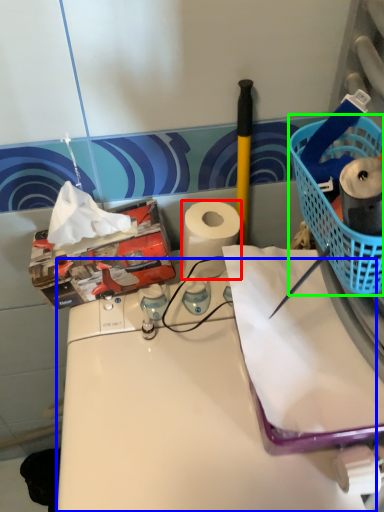
Question: Considering the real-world distances, which object is closest to paper towel (highlighted by a red box)? counter (highlighted by a blue box) or basket (highlighted by a green box).

Choices:
 (A) counter
 (B) basket

Answer: (A)